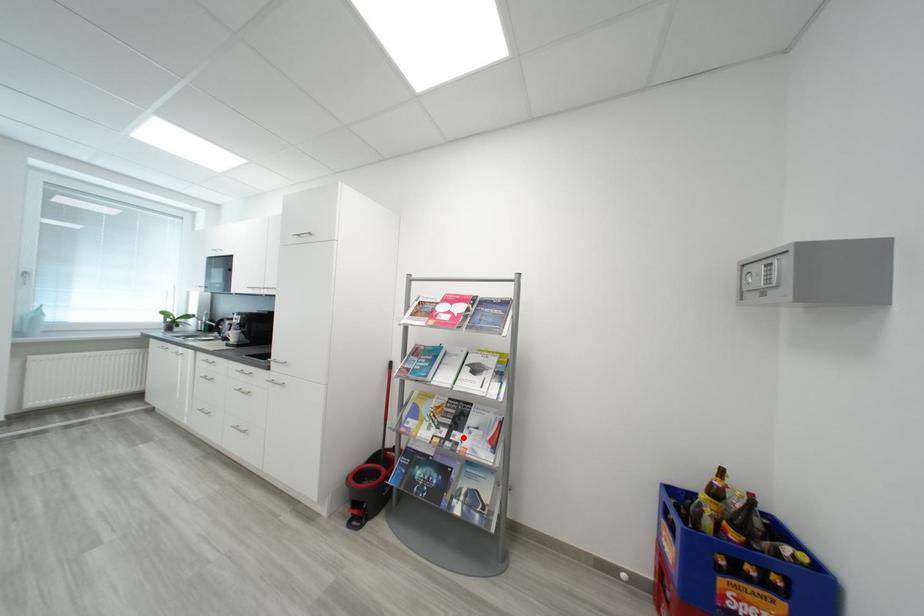
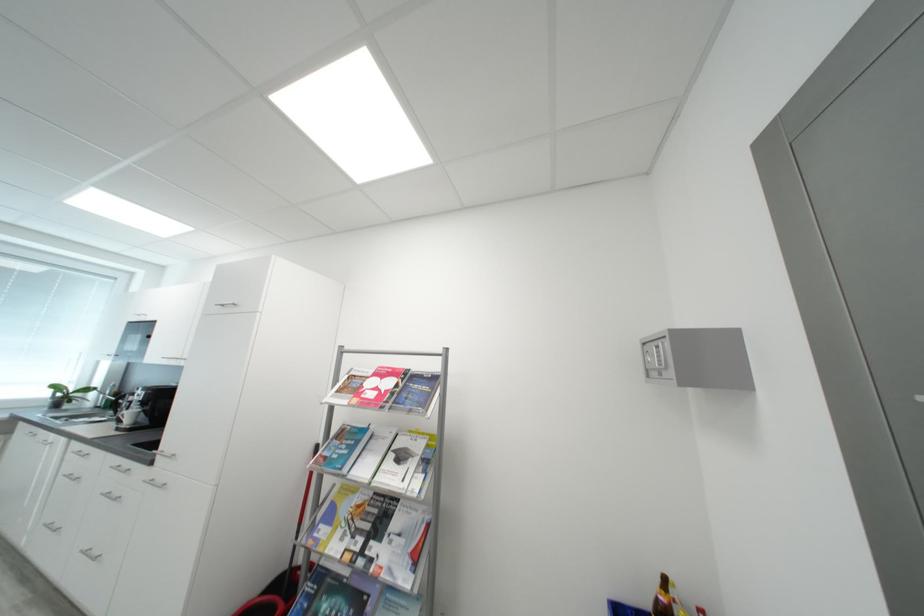
Locate, in the second image, the point that corresponds to the highlighted location in the first image.

(380, 549)